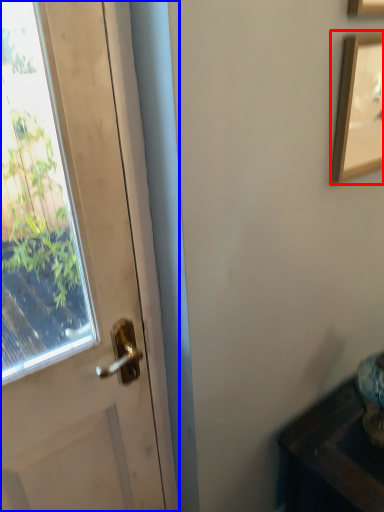
Question: Which of the following is the closest to the observer, picture frame (highlighted by a red box) or door (highlighted by a blue box)?

Choices:
 (A) picture frame
 (B) door

Answer: (B)